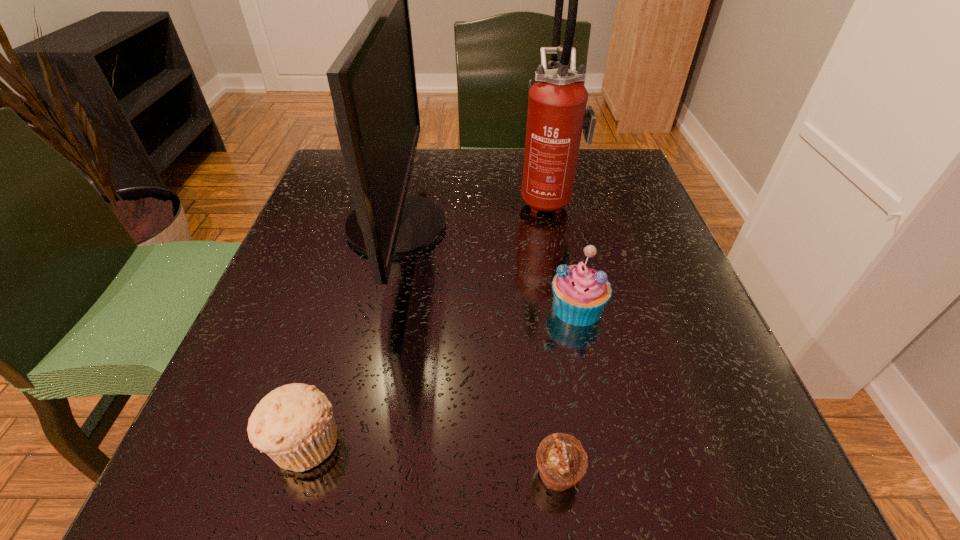
I want to click on free space that satisfies the following two spatial constraints: 1. at the nozzle of the farthest muffin; 2. on the right side of the fire extinguisher, so click(x=569, y=307).

Find the location of a particular element. The height and width of the screenshot is (540, 960). vacant point that satisfies the following two spatial constraints: 1. on the back side of the farthest muffin; 2. on the screen side of the monitor is located at coordinates (560, 226).

Find the location of a particular element. The height and width of the screenshot is (540, 960). free space that satisfies the following two spatial constraints: 1. on the back side of the farthest muffin; 2. on the screen side of the monitor is located at coordinates (560, 226).

Identify the location of blank space that satisfies the following two spatial constraints: 1. on the screen side of the monitor; 2. on the right side of the farthest muffin. (378, 307).

Where is `free space that satisfies the following two spatial constraints: 1. on the back side of the farthest muffin; 2. on the screen side of the monitor`? free space that satisfies the following two spatial constraints: 1. on the back side of the farthest muffin; 2. on the screen side of the monitor is located at coordinates (560, 226).